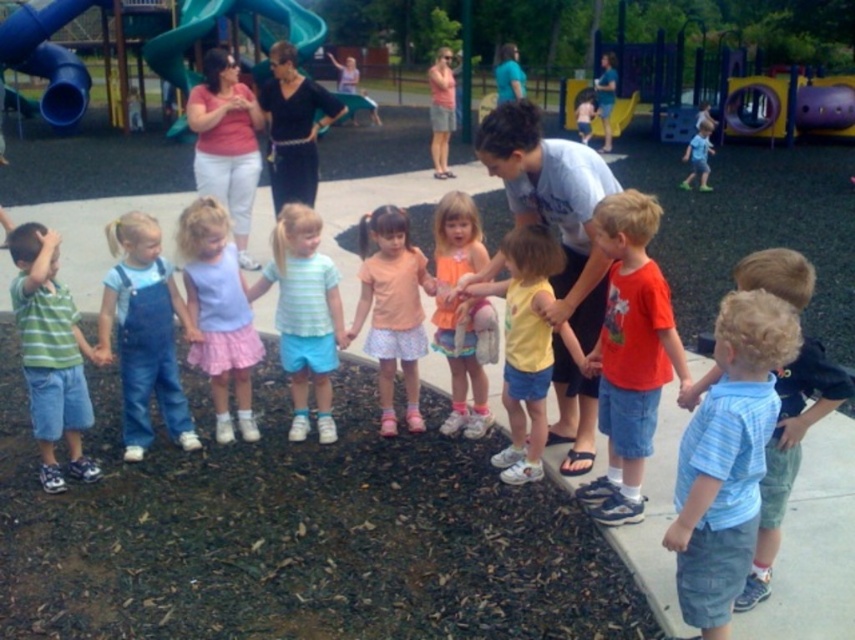
Between pastel blue fabric dress at center and smooth blue slide at upper left, which one is positioned lower?

pastel blue fabric dress at center is lower down.

Identify the location of pastel blue fabric dress at center. This screenshot has width=855, height=640. (217, 314).

Describe the element at coordinates (217, 314) in the screenshot. Image resolution: width=855 pixels, height=640 pixels. I see `pastel blue fabric dress at center` at that location.

Is pastel blue fabric dress at center above blue denim shorts at center?

No, pastel blue fabric dress at center is not above blue denim shorts at center.

What do you see at coordinates (217, 314) in the screenshot? The height and width of the screenshot is (640, 855). I see `pastel blue fabric dress at center` at bounding box center [217, 314].

Identify the location of pastel blue fabric dress at center. The image size is (855, 640). point(217,314).

Does denim overalls at left have a greater height compared to orange satin dress at center?

No.

Who is taller, denim overalls at left or orange satin dress at center?

With more height is orange satin dress at center.

Between point (133, 280) and point (458, 348), which one is positioned behind?

Positioned behind is point (458, 348).

The image size is (855, 640). What are the coordinates of `denim overalls at left` in the screenshot? It's located at (143, 332).